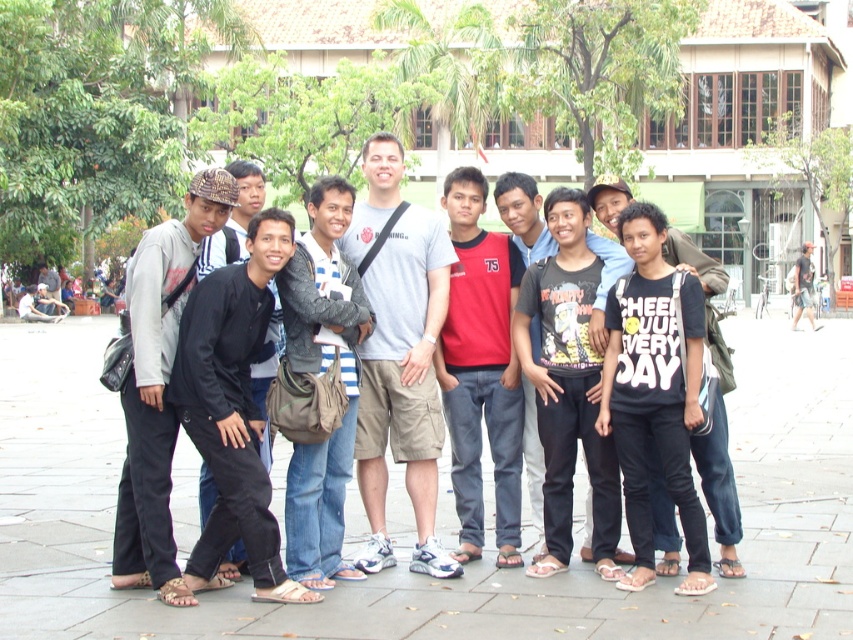
This screenshot has width=853, height=640. What do you see at coordinates (480, 369) in the screenshot? I see `red cotton shirt at center` at bounding box center [480, 369].

Is red cotton shirt at center above black matte pants at center?

No, red cotton shirt at center is not above black matte pants at center.

Is point (473, 269) less distant than point (550, 560)?

No.

This screenshot has height=640, width=853. I want to click on red cotton shirt at center, so click(x=480, y=369).

Does point (450, 417) come behind point (149, 545)?

Yes.

Can you confirm if red cotton shirt at center is positioned above dark gray fabric jacket at left?

Yes, red cotton shirt at center is above dark gray fabric jacket at left.

The width and height of the screenshot is (853, 640). What do you see at coordinates (480, 369) in the screenshot? I see `red cotton shirt at center` at bounding box center [480, 369].

Where is `red cotton shirt at center`? red cotton shirt at center is located at coordinates (480, 369).

Who is shorter, black matte jacket at center or black matte jacket at left?

black matte jacket at center

You are a GUI agent. You are given a task and a screenshot of the screen. Output one action in this format:
    pyautogui.click(x=<x>, y=<y>)
    Task: Click on the black matte jacket at center
    
    Given the screenshot: What is the action you would take?
    pyautogui.click(x=233, y=410)